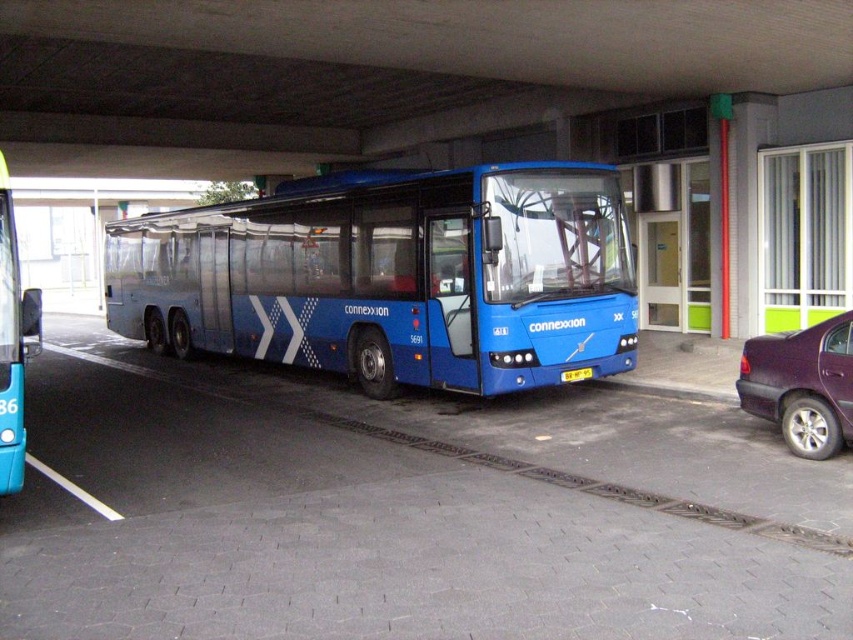
Question: In this image, where is metallic purple sedan at right located relative to yellow plastic license plate at center?

Choices:
 (A) below
 (B) above

Answer: (B)

Question: Which object appears closest to the camera in this image?

Choices:
 (A) blue metallic bus at center
 (B) yellow plastic license plate at center

Answer: (A)

Question: Does metallic purple sedan at right have a greater width compared to blue metallic bus at left?

Choices:
 (A) no
 (B) yes

Answer: (A)

Question: Which point is farther to the camera?

Choices:
 (A) yellow plastic license plate at center
 (B) metallic purple sedan at right
 (C) blue metallic bus at center
 (D) blue metallic bus at left

Answer: (A)

Question: Estimate the real-world distances between objects in this image. Which object is farther from the blue metallic bus at center?

Choices:
 (A) yellow plastic license plate at center
 (B) metallic purple sedan at right

Answer: (B)

Question: Does blue metallic bus at center appear on the left side of yellow plastic license plate at center?

Choices:
 (A) yes
 (B) no

Answer: (A)